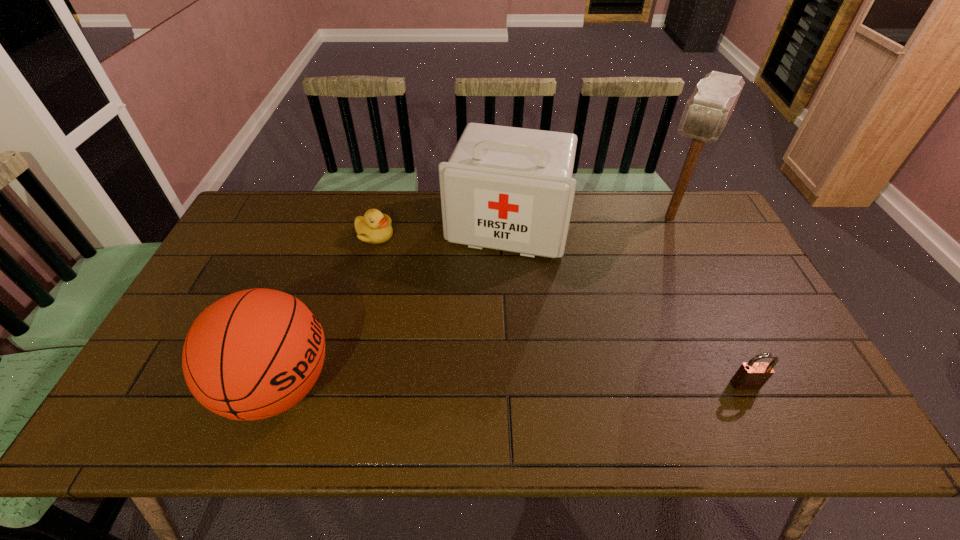
This screenshot has height=540, width=960. I want to click on the third tallest object, so click(251, 355).

At what (x,y) coordinates should I click in order to perform the action: click on padlock. Please return your answer as a coordinate pair (x, y). Image resolution: width=960 pixels, height=540 pixels. Looking at the image, I should click on (750, 376).

Image resolution: width=960 pixels, height=540 pixels. Find the location of `the shortest object`. the shortest object is located at coordinates (374, 228).

Where is `the tallest object`? This screenshot has height=540, width=960. the tallest object is located at coordinates (707, 111).

Identify the location of the fourth shortest object. (506, 188).

I want to click on the first-aid kit, so click(506, 188).

Identify the location of free space located on the side with logo of the basketball. (471, 386).

Where is `vacant space located on the beak of the shortest object`? This screenshot has width=960, height=540. vacant space located on the beak of the shortest object is located at coordinates (388, 255).

Where is `vacant space situated 0.120m on the beak of the shortest object`? vacant space situated 0.120m on the beak of the shortest object is located at coordinates (397, 269).

Locate an element on the screen. The image size is (960, 540). vacant space situated 0.110m on the beak of the shortest object is located at coordinates (396, 267).